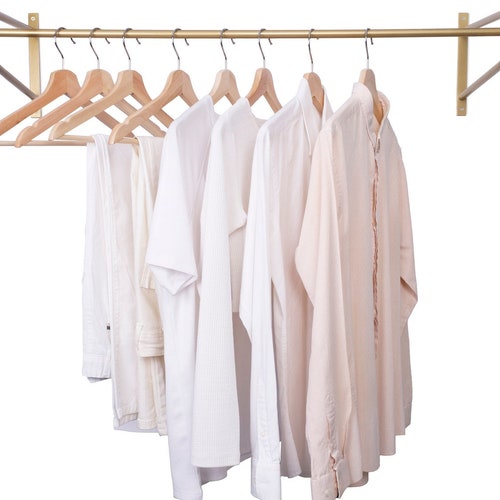
Identify the location of wooden hangers. (53, 85), (92, 83), (132, 80), (174, 86), (220, 88), (265, 86), (314, 85), (365, 79).